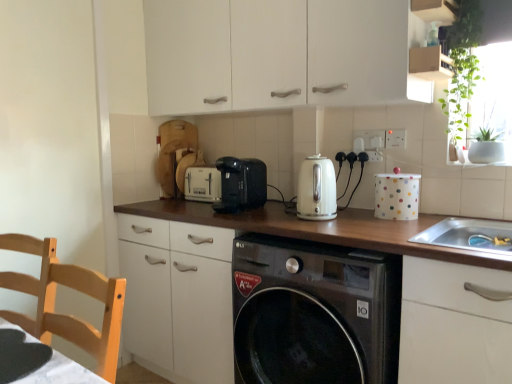
Question: Is white plastic electric outlet at upper right, the second electric outlet when ordered from left to right, with black glossy washing machine at center?

Choices:
 (A) no
 (B) yes

Answer: (A)

Question: Considering the relative positions of white plastic electric outlet at upper right, placed as the 1th electric outlet when sorted from front to back, and black glossy washing machine at center in the image provided, is white plastic electric outlet at upper right, placed as the 1th electric outlet when sorted from front to back, to the left of black glossy washing machine at center from the viewer's perspective?

Choices:
 (A) no
 (B) yes

Answer: (A)

Question: Is white plastic electric outlet at upper right, placed as the 1th electric outlet when sorted from front to back, bigger than black glossy washing machine at center?

Choices:
 (A) no
 (B) yes

Answer: (A)

Question: Can you confirm if white plastic electric outlet at upper right, the 2th electric outlet viewed from the back, is smaller than black glossy washing machine at center?

Choices:
 (A) no
 (B) yes

Answer: (B)

Question: Is white plastic electric outlet at upper right, the second electric outlet when ordered from left to right, turned away from black glossy washing machine at center?

Choices:
 (A) no
 (B) yes

Answer: (A)

Question: From a real-world perspective, is white plastic electric outlet at upper right, placed as the 1th electric outlet when sorted from front to back, on top of black glossy washing machine at center?

Choices:
 (A) no
 (B) yes

Answer: (B)

Question: From a real-world perspective, does white glossy kettle at center sit lower than green leafy plant at upper right?

Choices:
 (A) yes
 (B) no

Answer: (A)

Question: Does white glossy kettle at center have a lesser width compared to green leafy plant at upper right?

Choices:
 (A) no
 (B) yes

Answer: (B)

Question: Could you tell me if white glossy kettle at center is turned towards green leafy plant at upper right?

Choices:
 (A) yes
 (B) no

Answer: (B)

Question: Is white glossy kettle at center closer to the viewer compared to green leafy plant at upper right?

Choices:
 (A) yes
 (B) no

Answer: (B)

Question: Is white glossy kettle at center wider than green leafy plant at upper right?

Choices:
 (A) yes
 (B) no

Answer: (B)

Question: Is white glossy kettle at center at the right side of green leafy plant at upper right?

Choices:
 (A) yes
 (B) no

Answer: (B)

Question: Is the depth of light wood chair at left less than that of black plastic toaster at center?

Choices:
 (A) yes
 (B) no

Answer: (A)